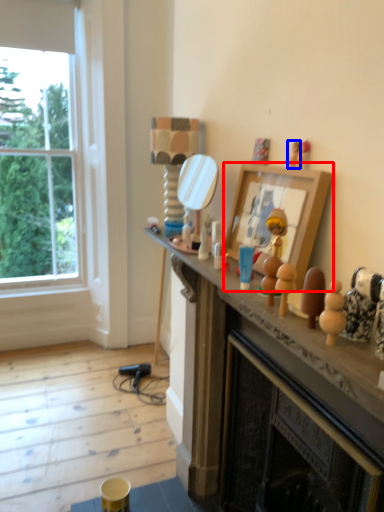
Question: Among these objects, which one is farthest to the camera, picture frame (highlighted by a red box) or toy (highlighted by a blue box)?

Choices:
 (A) picture frame
 (B) toy

Answer: (B)